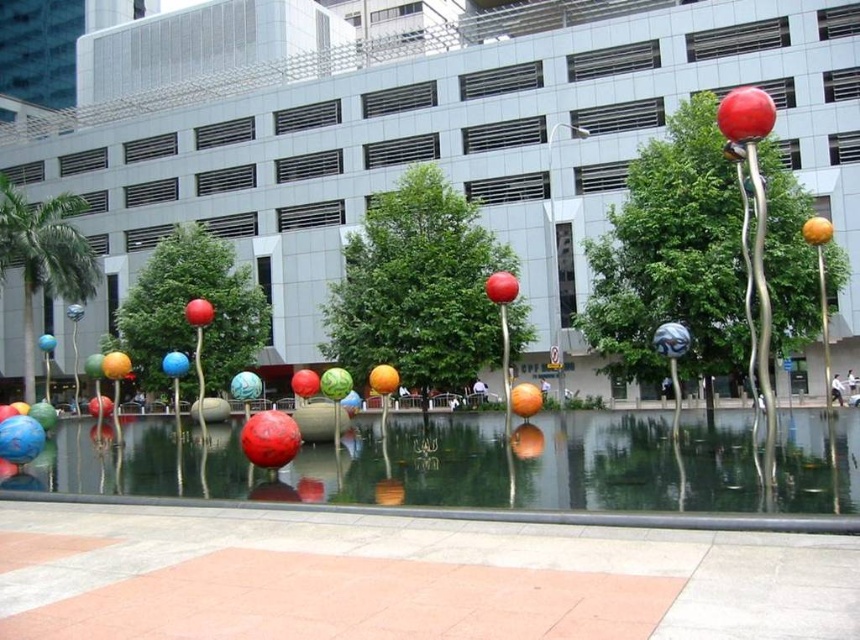
Which of these two, shiny metallic sphere at upper right or shiny metallic sphere at center, stands taller?

With more height is shiny metallic sphere at upper right.

Does shiny metallic sphere at upper right have a greater width compared to shiny metallic sphere at center?

Yes, shiny metallic sphere at upper right is wider than shiny metallic sphere at center.

Which is in front, point (726, 97) or point (204, 321)?

Point (204, 321) is more forward.

The width and height of the screenshot is (860, 640). Find the location of `shiny metallic sphere at upper right`. shiny metallic sphere at upper right is located at coordinates (745, 115).

Which is more to the right, shiny metallic sphere at center or blue glossy ball at center?

shiny metallic sphere at center

Does shiny metallic sphere at center have a lesser height compared to blue glossy ball at center?

Yes.

At what (x,y) coordinates should I click in order to perform the action: click on shiny metallic sphere at center. Please return your answer as a coordinate pair (x, y). Looking at the image, I should click on (198, 312).

The image size is (860, 640). What are the coordinates of `shiny metallic sphere at center` in the screenshot? It's located at (198, 312).

Which is in front, point (690, 451) or point (725, 120)?

Point (725, 120) is more forward.

Is point (83, 476) positioned behind point (771, 118)?

Yes, point (83, 476) is behind point (771, 118).

What are the coordinates of `glossy metallic water at center` in the screenshot? It's located at (431, 464).